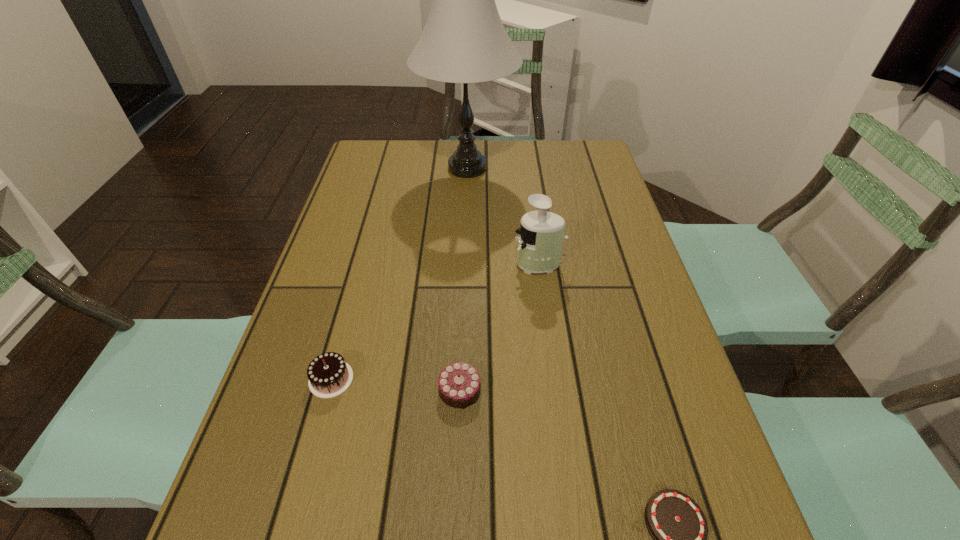
Find the location of a particular element. vacant area situated on the front of the leftmost object is located at coordinates (292, 521).

Identify the location of vacant space located 0.180m on the front of the second tallest chocolate cake. The image size is (960, 540). (455, 516).

The image size is (960, 540). I want to click on object that is positioned at the far edge, so click(464, 40).

The height and width of the screenshot is (540, 960). In order to click on object present at the left edge in this screenshot , I will do `click(329, 375)`.

Locate an element on the screen. The height and width of the screenshot is (540, 960). vacant position at the far edge of the desktop is located at coordinates (489, 148).

I want to click on vacant space at the left edge of the desktop, so click(x=350, y=279).

Where is `vacant space at the right edge of the desktop`? Image resolution: width=960 pixels, height=540 pixels. vacant space at the right edge of the desktop is located at coordinates (577, 223).

Locate an element on the screen. vacant space at the far left corner of the desktop is located at coordinates (389, 167).

Where is `vacant position at the far right corner of the desktop`? The image size is (960, 540). vacant position at the far right corner of the desktop is located at coordinates (569, 149).

Find the location of a particular element. empty space that is in between the second shortest chocolate cake and the third shortest object is located at coordinates (396, 384).